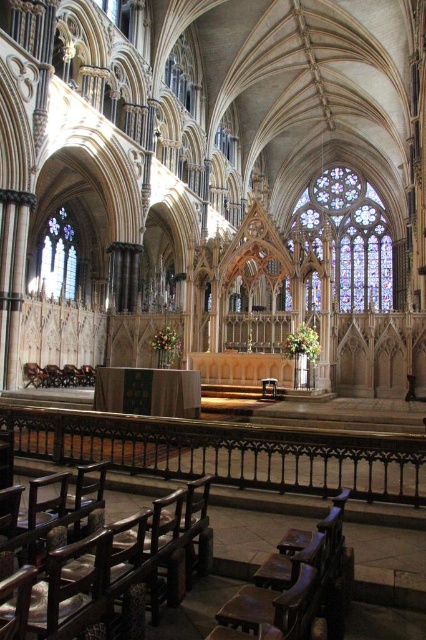
You are standing at the entrance of the cathedral and want to sit down. You see a wooden polished chair at lower center and a clear glass window at left. Which object is closer to your right side?

The wooden polished chair at lower center is to the right of the clear glass window at left, so it is closer to your right side.

You are a tour guide leading a group through the cathedral. You want to move from the wooden polished chair at lower center to the stained glass at upper right. Considering the cathedral is 400 feet long, can you reach the stained glass without walking the entire length of the cathedral?

The distance between the stained glass at upper right and the wooden polished chair at lower center is 399.10 feet, which is just shy of the cathedral being 400 feet long. Therefore, you can reach the stained glass without walking the entire length of the cathedral.

You are a tour guide leading a group through the cathedral. You want to move from the dark brown wood chair at lower left to the clear glass window at left. Is there enough space for a 1.5 meter wide tour cart to pass through the path between them?

The distance between the dark brown wood chair at lower left and the clear glass window at left is 48.88 meters, so yes, the tour cart can pass through the path between them since the distance is much larger than the cart width.